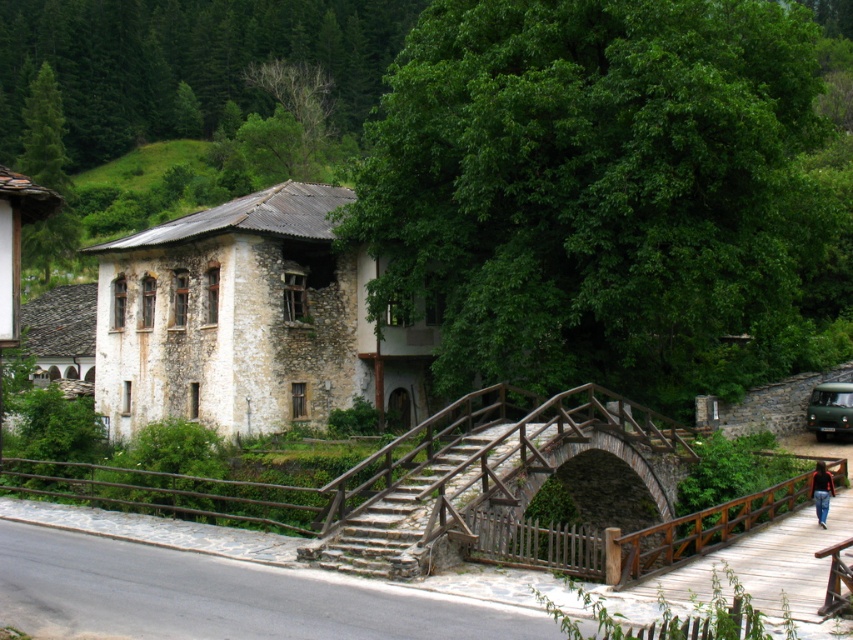
Can you confirm if green matte van at right is wider than black fabric jacket at lower right?

Yes, green matte van at right is wider than black fabric jacket at lower right.

Does green matte van at right have a greater height compared to black fabric jacket at lower right?

Yes.

Is point (845, 396) in front of point (817, 467)?

No, it is behind (817, 467).

I want to click on green matte van at right, so click(830, 410).

Is wooden bridge at center closer to the viewer compared to stone/stained wood stairs at center?

Yes.

Who is taller, wooden bridge at center or stone/stained wood stairs at center?

wooden bridge at center

Find the location of a particular element. The width and height of the screenshot is (853, 640). wooden bridge at center is located at coordinates (477, 470).

At what (x,y) coordinates should I click in order to perform the action: click on wooden bridge at center. Please return your answer as a coordinate pair (x, y). Looking at the image, I should click on click(x=477, y=470).

Between point (389, 504) and point (819, 490), which one is positioned in front?

Point (389, 504) is more forward.

Who is more distant from viewer, (415, 467) or (828, 472)?

Point (828, 472)

Where is `stone/stained wood stairs at center`? stone/stained wood stairs at center is located at coordinates (393, 513).